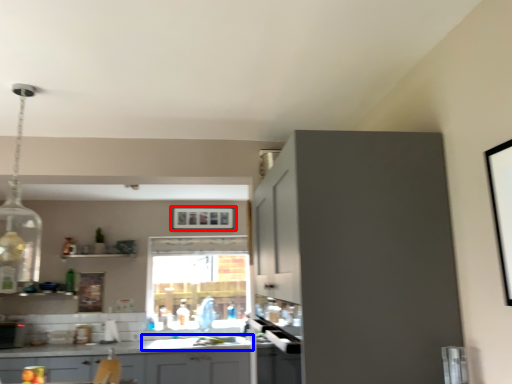
Question: Which point is closer to the camera, picture frame (highlighted by a red box) or sink (highlighted by a blue box)?

Choices:
 (A) picture frame
 (B) sink

Answer: (B)